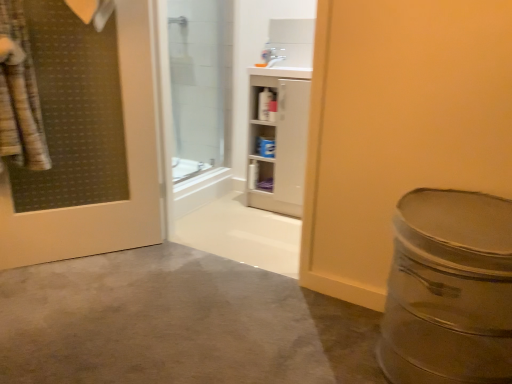
Question: Based on their positions, is transparent glass shower door at upper center located to the left or right of white glossy cabinet at upper center?

Choices:
 (A) right
 (B) left

Answer: (B)

Question: From the image's perspective, is transparent glass shower door at upper center positioned above or below white glossy cabinet at upper center?

Choices:
 (A) below
 (B) above

Answer: (B)

Question: Which is nearer to the white glossy cabinet at upper center?

Choices:
 (A) white glossy cabinet at center
 (B) transparent glass shower door at upper center

Answer: (A)

Question: Estimate the real-world distances between objects in this image. Which object is farther from the white glossy cabinet at upper center?

Choices:
 (A) white glossy cabinet at center
 (B) transparent glass shower door at upper center

Answer: (B)